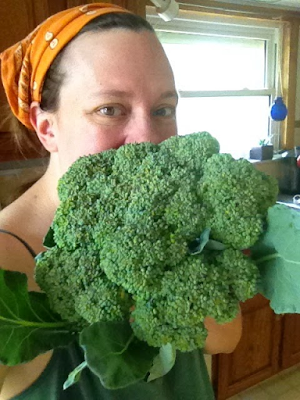
Where is `sink`? The height and width of the screenshot is (400, 300). sink is located at coordinates (286, 203).